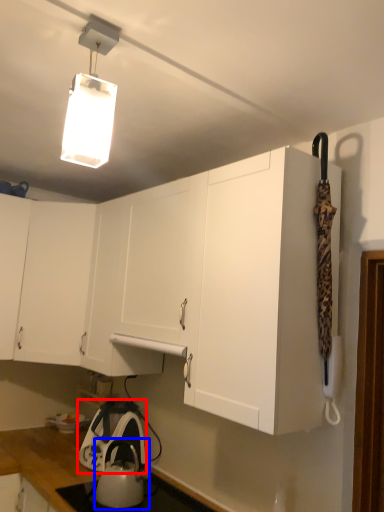
Question: Which object appears farthest to the camera in this image, appliance (highlighted by a red box) or kettle (highlighted by a blue box)?

Choices:
 (A) appliance
 (B) kettle

Answer: (A)